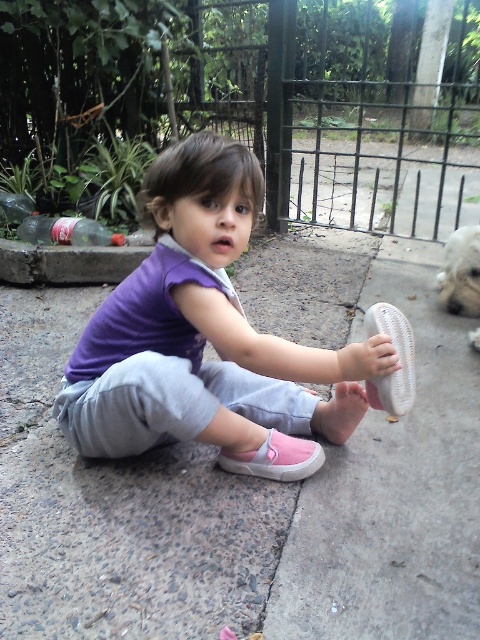
You are a photographer trying to capture both the pink fabric shoe at center and the white fluffy dog at right in a single shot. Since you want to ensure both are in focus, which object should you focus on first to account for their distances?

You should focus on the pink fabric shoe at center first because it is closer to the viewer than the white fluffy dog at right, so adjusting focus starting from the closer object ensures both can be in focus.

You are a delivery robot that is 1 meter tall. You need to pick up the pink fabric shoe at center. Can you reach it?

The pink fabric shoe at center and viewer are 1.18 meters apart. Since the robot is 1 meter tall, it cannot reach the shoe as it is slightly out of reach.